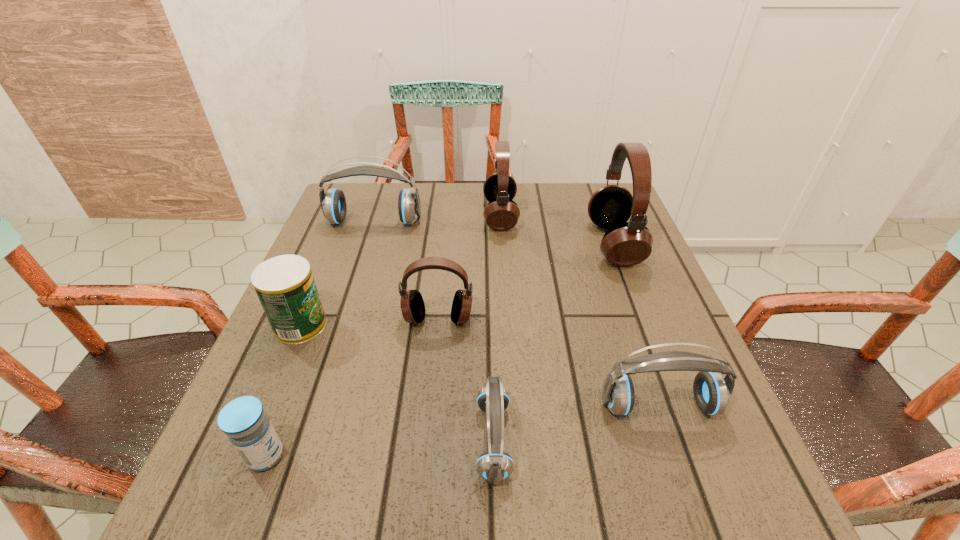
What are the coordinates of `unoccupied area between the farthest blue headset and the can` in the screenshot? It's located at (337, 273).

Locate an element on the screen. This screenshot has height=540, width=960. vacant space that is in between the second smallest black headset and the shortest headset is located at coordinates (497, 328).

This screenshot has width=960, height=540. Identify the location of vacant area between the shortest headset and the leftmost blue headset. (434, 331).

I want to click on free space between the rightmost blue headset and the can, so (x=480, y=365).

At what (x,y) coordinates should I click in order to perform the action: click on vacant area that lies between the can and the blue medicine. Please return your answer as a coordinate pair (x, y). The image size is (960, 540). Looking at the image, I should click on (283, 390).

This screenshot has height=540, width=960. In order to click on free spot between the tallest object and the can in this screenshot , I will do `click(457, 284)`.

You are a GUI agent. You are given a task and a screenshot of the screen. Output one action in this format:
    pyautogui.click(x=<x>, y=<y>)
    Task: Click on the free space between the leftmost black headset and the shortest headset
    The image size is (960, 540).
    Given the screenshot: What is the action you would take?
    tap(466, 380)

I want to click on unoccupied position between the second blue headset from right to left and the second smallest black headset, so click(497, 328).

Image resolution: width=960 pixels, height=540 pixels. In order to click on vacant region between the rightmost black headset and the medicine in this screenshot , I will do `click(440, 350)`.

Locate an element on the screen. This screenshot has height=540, width=960. object that ranks as the fifth closest to the can is located at coordinates (501, 213).